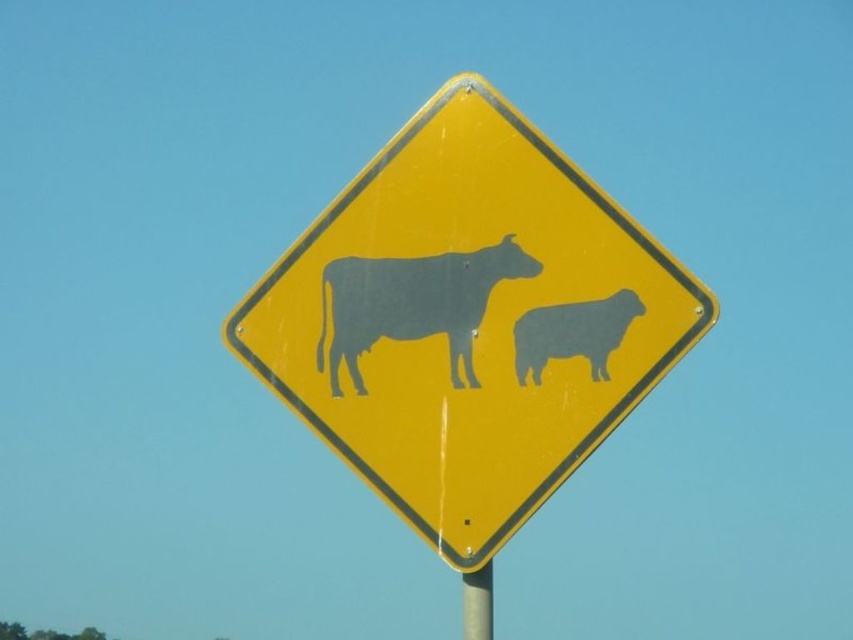
Question: Estimate the real-world distances between objects in this image. Which object is farther from the metallic yellow pole at center?

Choices:
 (A) gray matte sheep at center
 (B) yellow plastic sign at center
 (C) matte gray bull at center

Answer: (C)

Question: Based on their relative distances, which object is farther from the gray matte sheep at center?

Choices:
 (A) yellow plastic sign at center
 (B) matte gray bull at center

Answer: (A)

Question: Can you confirm if yellow plastic sign at center is positioned to the left of matte gray bull at center?

Choices:
 (A) no
 (B) yes

Answer: (A)

Question: Is matte gray bull at center behind gray matte sheep at center?

Choices:
 (A) no
 (B) yes

Answer: (B)

Question: Which is nearer to the gray matte sheep at center?

Choices:
 (A) yellow plastic sign at center
 (B) matte gray bull at center
 (C) metallic yellow pole at center

Answer: (B)

Question: Can you confirm if yellow plastic sign at center is positioned to the left of metallic yellow pole at center?

Choices:
 (A) yes
 (B) no

Answer: (A)